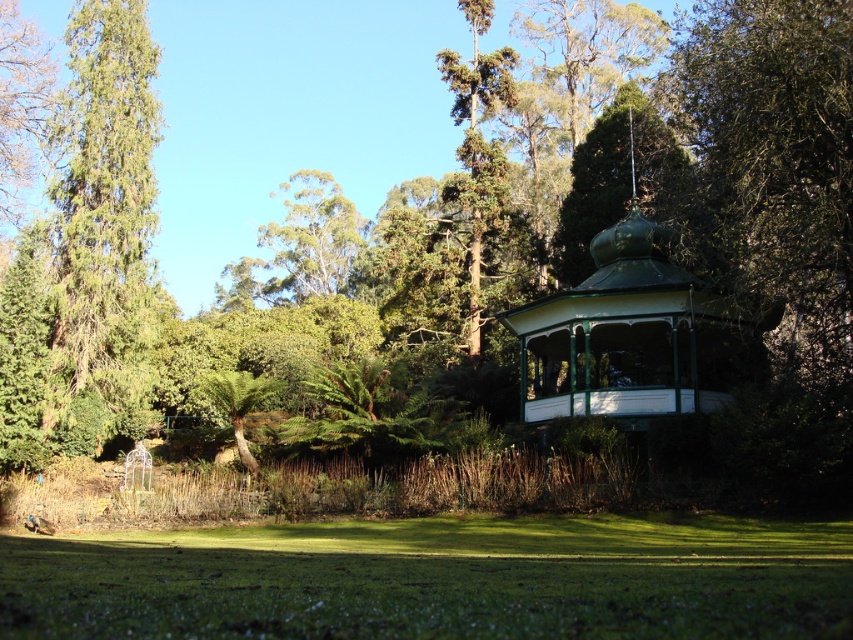
Question: Which object is closer to the camera taking this photo?

Choices:
 (A) green grassy field at lower center
 (B) green painted wood gazebo at center right

Answer: (A)

Question: Which point appears farthest from the camera in this image?

Choices:
 (A) (529, 403)
 (B) (392, 621)

Answer: (A)

Question: Which point appears farthest from the camera in this image?

Choices:
 (A) (312, 579)
 (B) (669, 262)

Answer: (B)

Question: From the image, what is the correct spatial relationship of green grassy field at lower center in relation to green painted wood gazebo at center right?

Choices:
 (A) below
 (B) above

Answer: (A)

Question: Can you confirm if green painted wood gazebo at center right is thinner than green textured tree at left?

Choices:
 (A) no
 (B) yes

Answer: (A)

Question: Is green grassy field at lower center above green painted wood gazebo at center right?

Choices:
 (A) yes
 (B) no

Answer: (B)